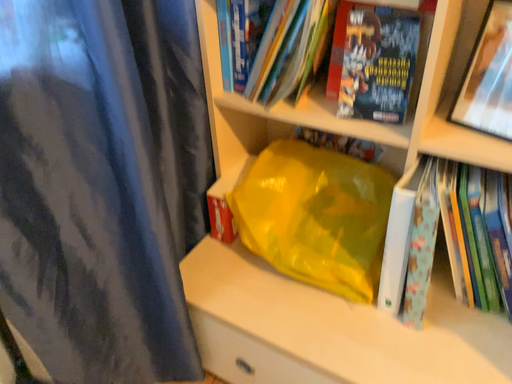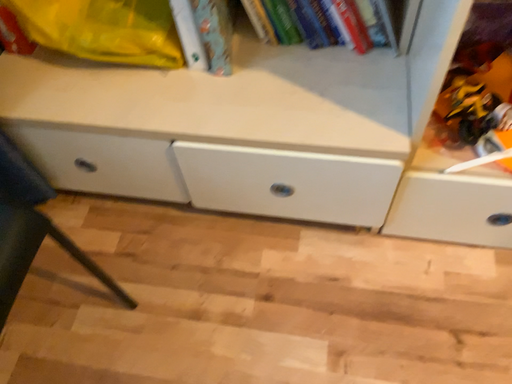
Question: How did the camera likely rotate when shooting the video?

Choices:
 (A) rotated upward
 (B) rotated downward

Answer: (B)